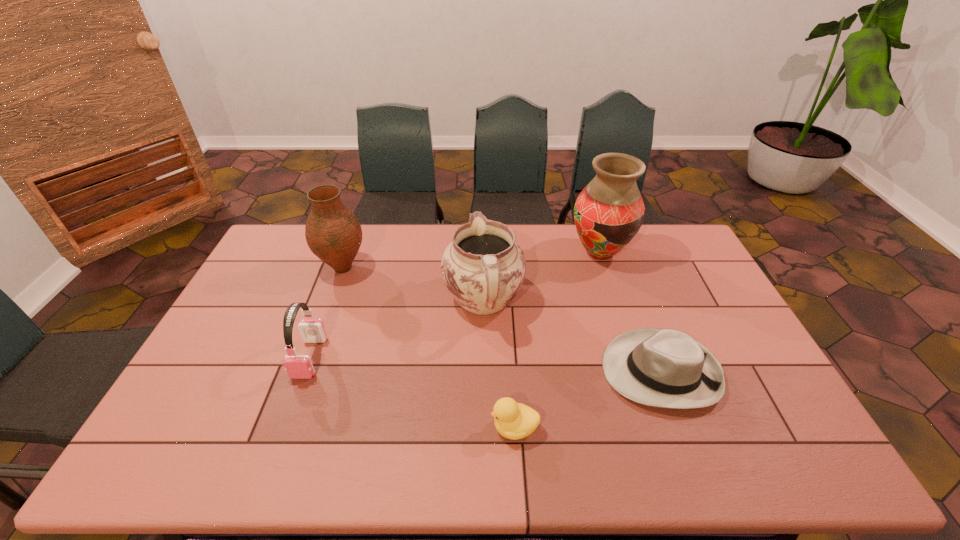
I want to click on blank space at the far edge of the desktop, so click(594, 261).

The image size is (960, 540). In the image, there is a desktop. Identify the location of free region at the near edge. (271, 438).

Locate an element on the screen. free space at the left edge of the desktop is located at coordinates (179, 394).

In the image, there is a desktop. At what (x,y) coordinates should I click in order to perform the action: click on vacant region at the near left corner. Please return your answer as a coordinate pair (x, y). The width and height of the screenshot is (960, 540). Looking at the image, I should click on (201, 471).

In the image, there is a desktop. Where is `vacant space at the far right corner`? This screenshot has height=540, width=960. vacant space at the far right corner is located at coordinates (695, 259).

The width and height of the screenshot is (960, 540). Find the location of `free area in between the earphone and the fedora`. free area in between the earphone and the fedora is located at coordinates (485, 364).

Locate an element on the screen. vacant space in between the left vase and the earphone is located at coordinates 326,313.

The image size is (960, 540). I want to click on empty space between the pitcher and the duck, so click(499, 364).

Locate an element on the screen. This screenshot has height=540, width=960. vacant space that is in between the third shortest object and the fedora is located at coordinates (485, 364).

The width and height of the screenshot is (960, 540). I want to click on vacant area that lies between the duck and the left vase, so click(429, 348).